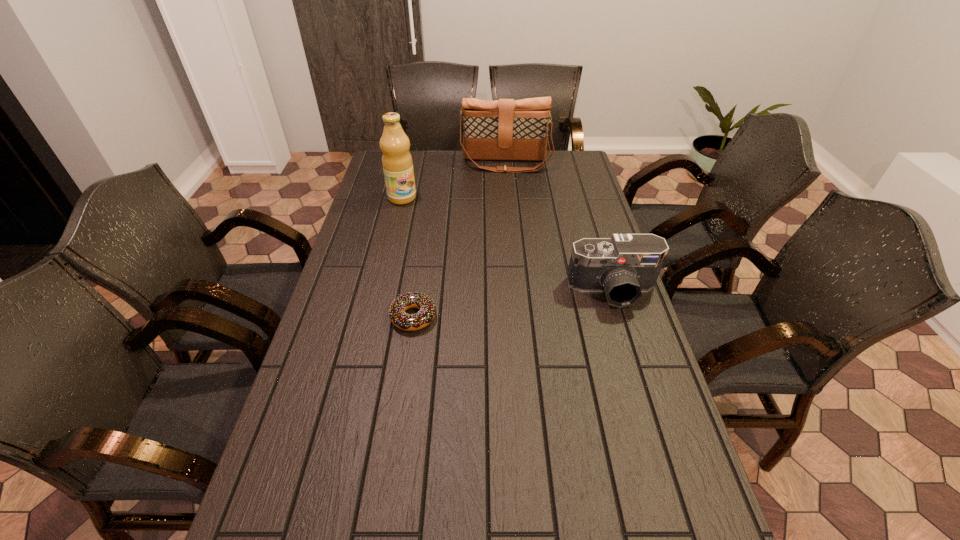
Identify the location of free location located on the front-facing side of the farthest object. tap(505, 181).

Find the location of `free space located on the label of the second farthest object`. free space located on the label of the second farthest object is located at coordinates pyautogui.click(x=421, y=220).

Image resolution: width=960 pixels, height=540 pixels. What are the coordinates of `free space located 0.080m on the label of the second farthest object` in the screenshot? It's located at (417, 215).

This screenshot has height=540, width=960. In order to click on free space located on the label of the second farthest object in this screenshot , I will do [x=446, y=251].

Where is `object that is positioned at the far edge`? object that is positioned at the far edge is located at coordinates (506, 129).

Where is `object present at the left edge`? The height and width of the screenshot is (540, 960). object present at the left edge is located at coordinates (397, 163).

Identify the location of camera that is at the right edge. Image resolution: width=960 pixels, height=540 pixels. (623, 266).

Locate an element on the screen. Image resolution: width=960 pixels, height=540 pixels. shoulder bag that is at the right edge is located at coordinates (506, 129).

Locate an element on the screen. object that is at the far right corner is located at coordinates (506, 129).

Locate an element on the screen. The width and height of the screenshot is (960, 540). vacant space at the far edge of the desktop is located at coordinates (502, 173).